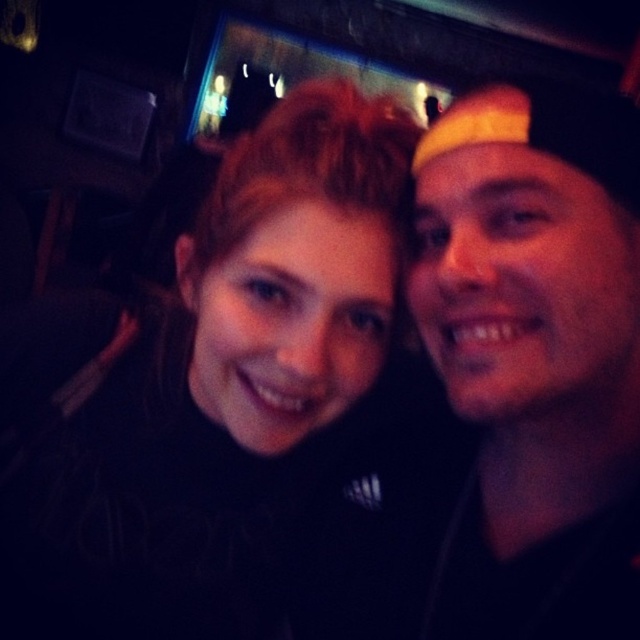
Question: Does black matte hair at center appear under yellow fabric cap at right?

Choices:
 (A) no
 (B) yes

Answer: (B)

Question: Which point is closer to the camera taking this photo?

Choices:
 (A) (125, 372)
 (B) (538, 333)

Answer: (B)

Question: Which point is closer to the camera?

Choices:
 (A) black matte hair at center
 (B) yellow fabric cap at right

Answer: (B)

Question: Does black matte hair at center have a greater width compared to yellow fabric cap at right?

Choices:
 (A) yes
 (B) no

Answer: (A)

Question: Which point is closer to the camera taking this photo?

Choices:
 (A) (321, 241)
 (B) (522, 620)

Answer: (A)

Question: Does black matte hair at center lie behind yellow fabric cap at right?

Choices:
 (A) no
 (B) yes

Answer: (B)